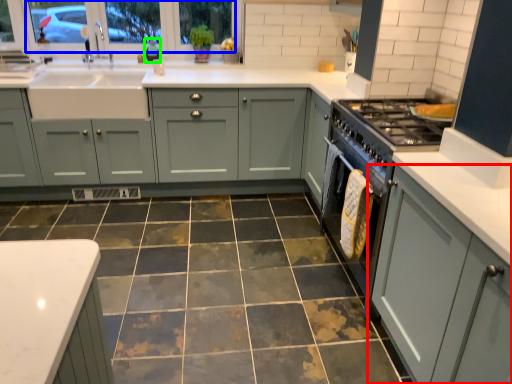
Question: Estimate the real-world distances between objects in this image. Which object is closer to cabinetry (highlighted by a red box), window screen (highlighted by a blue box) or teal (highlighted by a green box)?

Choices:
 (A) window screen
 (B) teal

Answer: (A)